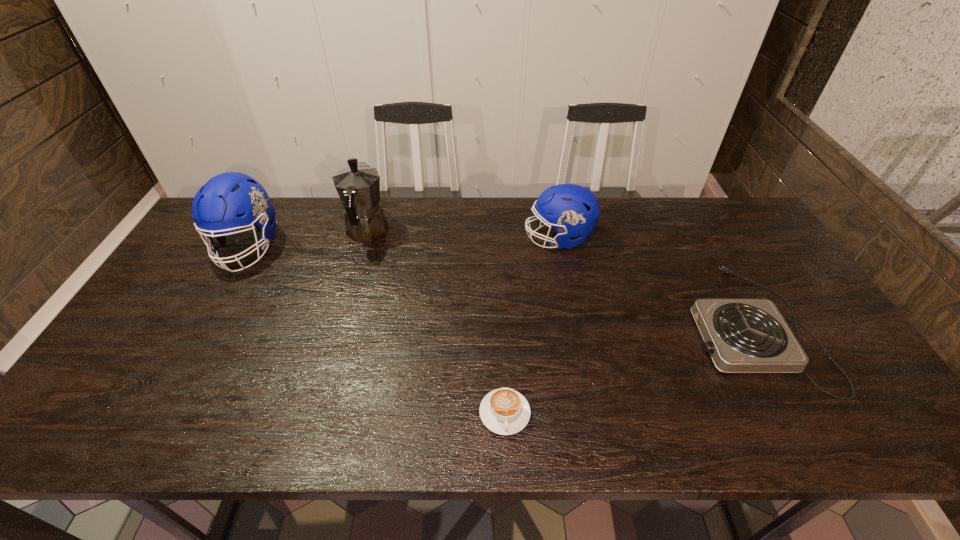
This screenshot has width=960, height=540. Find the location of `empty location between the third tallest object and the second object from left to right`. empty location between the third tallest object and the second object from left to right is located at coordinates (463, 235).

In order to click on vacant region between the rightmost object and the third shortest object in this screenshot , I will do `click(655, 282)`.

Image resolution: width=960 pixels, height=540 pixels. In order to click on vacant space that's between the rightmost object and the shorter football helmet in this screenshot , I will do `click(655, 282)`.

Image resolution: width=960 pixels, height=540 pixels. What are the coordinates of `free spot between the hotplate and the taller football helmet` in the screenshot? It's located at (498, 287).

At what (x,y) coordinates should I click in order to perform the action: click on the fourth closest object relative to the coffeepot. Please return your answer as a coordinate pair (x, y). Looking at the image, I should click on (741, 335).

Identify which object is located as the nearest to the leftmost object. Please provide its 2D coordinates. Your answer should be formatted as a tuple, i.e. [(x, y)], where the tuple contains the x and y coordinates of a point satisfying the conditions above.

[(358, 186)]

You are a GUI agent. You are given a task and a screenshot of the screen. Output one action in this format:
    pyautogui.click(x=<x>, y=<y>)
    Task: Click on the vacant space that satisfies the following two spatial constraints: 1. with a retractable cable on the side of the rightmost object; 2. on the side of the third object from right to left with the handle
    The image size is (960, 540).
    Given the screenshot: What is the action you would take?
    pyautogui.click(x=798, y=413)

I want to click on vacant region that satisfies the following two spatial constraints: 1. on the front-facing side of the right football helmet; 2. on the side of the cappuccino with the handle, so click(x=592, y=413).